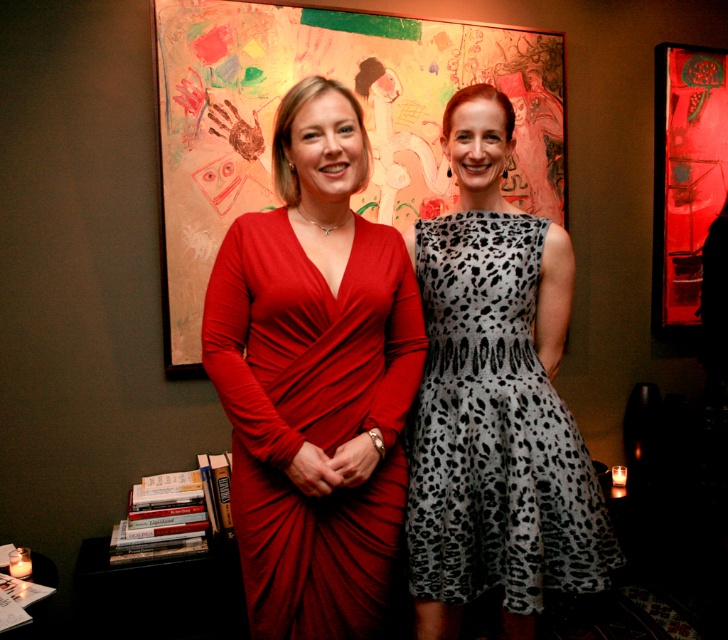
You are a photographer setting up a shoot in a studio. You need to position two models wearing the matte red dress at center and the gray leopard print dress at center. According to the scene, which dress is closer to the camera?

The matte red dress at center is in front of the gray leopard print dress at center, so the matte red dress at center is closer to the camera.

You are standing in front of the image and want to locate the point at coordinates (314, 378). Which object from the scene does this point belong to?

The point at coordinates (314, 378) is on the matte red dress at center.

You are a photographer setting up a shoot in this room. You need to ensure that the matte red dress at center and the painted canvas artwork at center are both visible in the frame. Based on their positions, which object should you focus on first to ensure both are in the shot?

The matte red dress at center is positioned under the painted canvas artwork at center, so focusing on the artwork first will allow the dress to naturally fall into the frame below it.